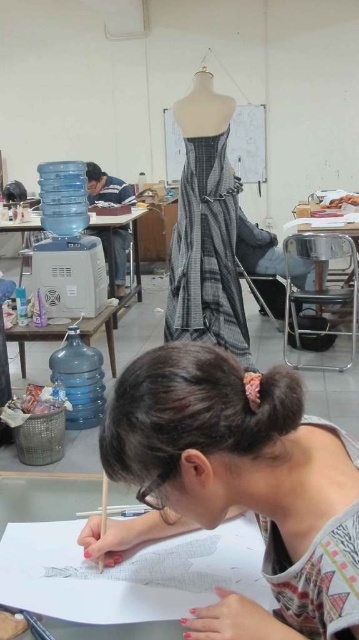
Between point (188, 381) and point (100, 320), which one is positioned in front?

Positioned in front is point (188, 381).

Does point (346, 573) lie behind point (86, 342)?

No.

Find the location of a particular element. The height and width of the screenshot is (640, 359). matte gray dress at center is located at coordinates (236, 484).

The width and height of the screenshot is (359, 640). Describe the element at coordinates (236, 484) in the screenshot. I see `matte gray dress at center` at that location.

At what (x,y) coordinates should I click in order to perform the action: click on matte gray dress at center. Please return your answer as a coordinate pair (x, y). Image resolution: width=359 pixels, height=640 pixels. Looking at the image, I should click on (236, 484).

Is point (28, 332) positioned behind point (134, 285)?

No, it is not.

Which is behind, point (34, 332) or point (2, 234)?

Positioned behind is point (2, 234).

Locate an element on the screen. matte plastic table at lower left is located at coordinates (34, 339).